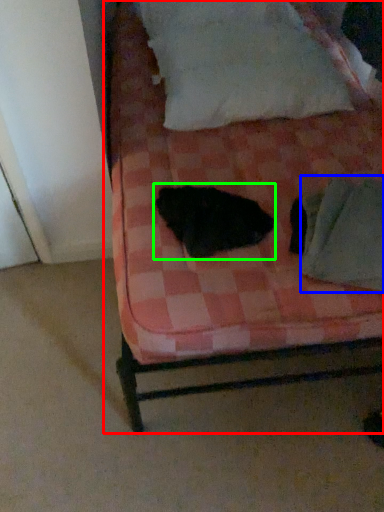
Question: Which object is the farthest from bed (highlighted by a red box)? Choose among these: linen (highlighted by a blue box) or animal (highlighted by a green box).

Choices:
 (A) linen
 (B) animal

Answer: (A)